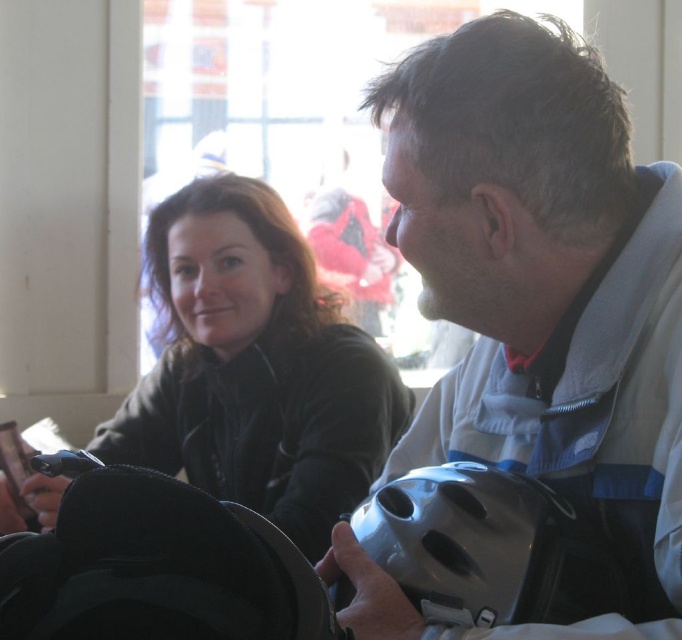
Question: Which object is closer to the camera taking this photo?

Choices:
 (A) matte black jacket at center
 (B) matte gray helmet at lower right

Answer: (B)

Question: Does matte black jacket at center appear on the right side of black fabric helmet at lower left?

Choices:
 (A) no
 (B) yes

Answer: (A)

Question: Does metallic gray helmet at center have a lesser width compared to matte gray helmet at lower right?

Choices:
 (A) no
 (B) yes

Answer: (A)

Question: From the image, what is the correct spatial relationship of matte black jacket at center in relation to matte gray helmet at lower right?

Choices:
 (A) above
 (B) below

Answer: (A)

Question: Which object appears closest to the camera in this image?

Choices:
 (A) black fabric helmet at lower left
 (B) matte black jacket at center
 (C) matte gray helmet at lower right
 (D) metallic gray helmet at center

Answer: (A)

Question: Which point is closer to the camera?

Choices:
 (A) metallic gray helmet at center
 (B) matte black jacket at center
 (C) black fabric helmet at lower left

Answer: (C)